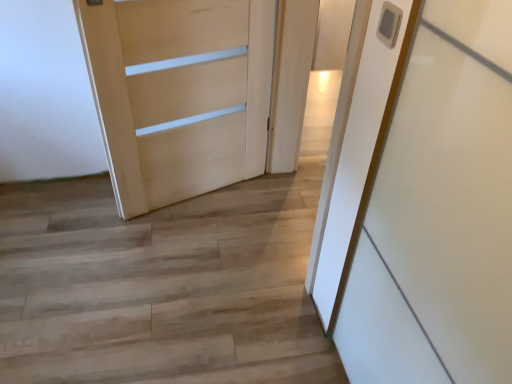
Identify the location of vacant area situated to the left side of light wood door at center, which appears as the 2th door when viewed from the right. (69, 218).